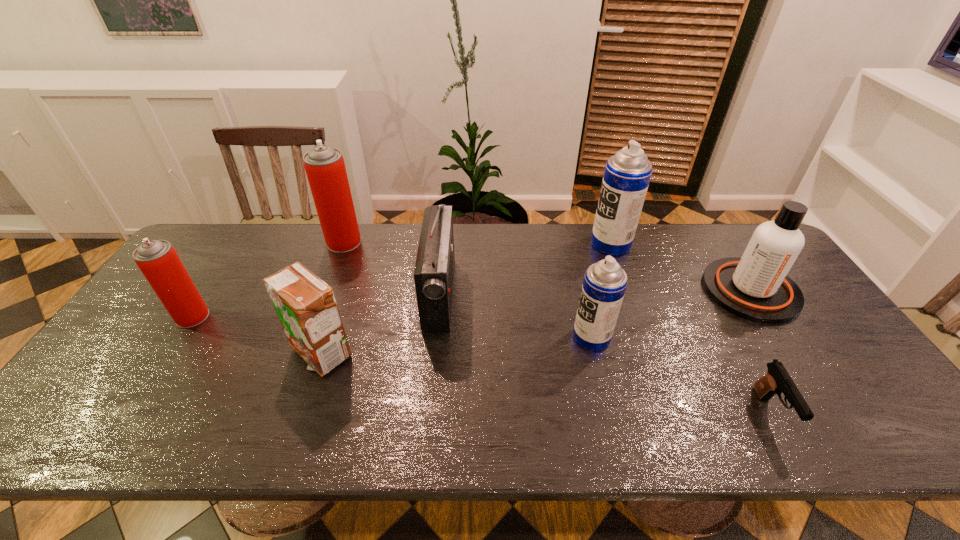
Where is `carton`? The width and height of the screenshot is (960, 540). carton is located at coordinates [306, 307].

At what (x,y) coordinates should I click in order to perform the action: click on pistol. Please return your answer as a coordinate pair (x, y). Image resolution: width=960 pixels, height=540 pixels. Looking at the image, I should click on (777, 380).

In order to click on the shortest object in this screenshot , I will do `click(777, 380)`.

This screenshot has height=540, width=960. I want to click on vacant space located 0.200m on the front of the bigger red aerosol can, so click(324, 296).

Locate an element on the screen. This screenshot has width=960, height=540. vacant position located on the label side of the rightmost aerosol can is located at coordinates (486, 244).

You are a GUI agent. You are given a task and a screenshot of the screen. Output one action in this format:
    pyautogui.click(x=<x>, y=<y>)
    Task: Click on the free space located 0.300m on the label side of the rightmost aerosol can
    
    Given the screenshot: What is the action you would take?
    pyautogui.click(x=500, y=244)

The width and height of the screenshot is (960, 540). I want to click on free location located 0.160m on the label side of the rightmost aerosol can, so click(542, 244).

Where is `blank space located 0.370m on the front-facing side of the fourth object from left to right`? The height and width of the screenshot is (540, 960). blank space located 0.370m on the front-facing side of the fourth object from left to right is located at coordinates (581, 294).

Find the location of a particular element. This screenshot has width=960, height=540. free space located on the front of the white cleansing agent is located at coordinates (794, 356).

I want to click on vacant space located on the label side of the nearer blue aerosol can, so click(441, 337).